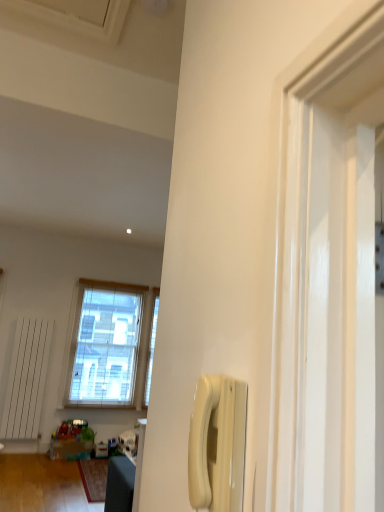
Question: Considering the positions of point tap(64, 396) and point tap(51, 438), is point tap(64, 396) closer or farther from the camera than point tap(51, 438)?

Choices:
 (A) farther
 (B) closer

Answer: (A)

Question: Is clear glass window at center in front of or behind translucent plastic toys at lower left in the image?

Choices:
 (A) front
 (B) behind

Answer: (B)

Question: Estimate the real-world distances between objects in this image. Which object is farther from the white plastic phone at center-right?

Choices:
 (A) translucent plastic toys at lower left
 (B) clear glass window at center

Answer: (B)

Question: Which object is the farthest from the clear glass window at center?

Choices:
 (A) white plastic phone at center-right
 (B) translucent plastic toys at lower left

Answer: (A)